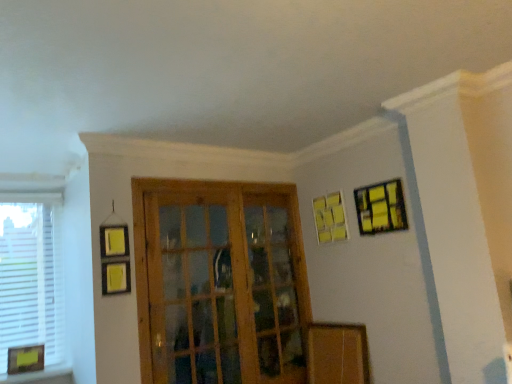
Question: Could you tell me if yellow matte picture frame at lower left, the third picture frame from the right, is turned towards yellow matte picture frame at upper right, which is counted as the first picture frame, starting from the right?

Choices:
 (A) yes
 (B) no

Answer: (B)

Question: Is yellow matte picture frame at upper right, which is the third picture frame from left to right, a part of yellow matte picture frame at lower left, arranged as the 1th picture frame when ordered from the bottom?

Choices:
 (A) no
 (B) yes

Answer: (A)

Question: From a real-world perspective, is yellow matte picture frame at lower left, the third picture frame from the right, under yellow matte picture frame at upper right, which ranks as the third picture frame in bottom-to-top order?

Choices:
 (A) no
 (B) yes

Answer: (B)

Question: Considering the relative positions of yellow matte picture frame at lower left, placed as the third picture frame when sorted from top to bottom, and yellow matte picture frame at upper right, which ranks as the third picture frame in bottom-to-top order, in the image provided, is yellow matte picture frame at lower left, placed as the third picture frame when sorted from top to bottom, to the right of yellow matte picture frame at upper right, which ranks as the third picture frame in bottom-to-top order, from the viewer's perspective?

Choices:
 (A) yes
 (B) no

Answer: (B)

Question: Is yellow matte picture frame at lower left, arranged as the 1th picture frame when ordered from the bottom, bigger than yellow matte picture frame at upper right, which is the third picture frame from left to right?

Choices:
 (A) yes
 (B) no

Answer: (B)

Question: From a real-world perspective, relative to yellow matte picture frame at lower left, the third picture frame from the right, is yellow matte picture frame at upper right, which is the third picture frame from left to right, vertically above or below?

Choices:
 (A) above
 (B) below

Answer: (A)

Question: Which is correct: yellow matte picture frame at upper right, which is the third picture frame from left to right, is inside yellow matte picture frame at lower left, the 1th picture frame positioned from the left, or outside of it?

Choices:
 (A) outside
 (B) inside

Answer: (A)

Question: Considering the positions of point (374, 226) and point (9, 349), is point (374, 226) closer or farther from the camera than point (9, 349)?

Choices:
 (A) farther
 (B) closer

Answer: (A)

Question: Looking at their shapes, would you say yellow matte picture frame at upper right, which is counted as the first picture frame, starting from the right, is wider or thinner than yellow matte picture frame at lower left, arranged as the 1th picture frame when ordered from the bottom?

Choices:
 (A) wide
 (B) thin

Answer: (B)

Question: Is yellow matte picture frame at upper right, the 1th picture frame viewed from the top, wider or thinner than wooden screen door at center?

Choices:
 (A) wide
 (B) thin

Answer: (A)

Question: From the image's perspective, is yellow matte picture frame at upper right, which is counted as the first picture frame, starting from the right, positioned above or below wooden screen door at center?

Choices:
 (A) above
 (B) below

Answer: (A)

Question: Would you say yellow matte picture frame at upper right, which is counted as the first picture frame, starting from the right, is to the left or to the right of wooden screen door at center in the picture?

Choices:
 (A) left
 (B) right

Answer: (B)

Question: From a real-world perspective, relative to wooden screen door at center, is yellow matte picture frame at upper right, which ranks as the third picture frame in bottom-to-top order, vertically above or below?

Choices:
 (A) above
 (B) below

Answer: (A)

Question: Is point (328, 213) positioned closer to the camera than point (4, 311)?

Choices:
 (A) closer
 (B) farther

Answer: (B)

Question: Looking at their shapes, would you say yellow matte picture frame at upper right, the second picture frame when ordered from bottom to top, is wider or thinner than white matte window at left?

Choices:
 (A) wide
 (B) thin

Answer: (A)